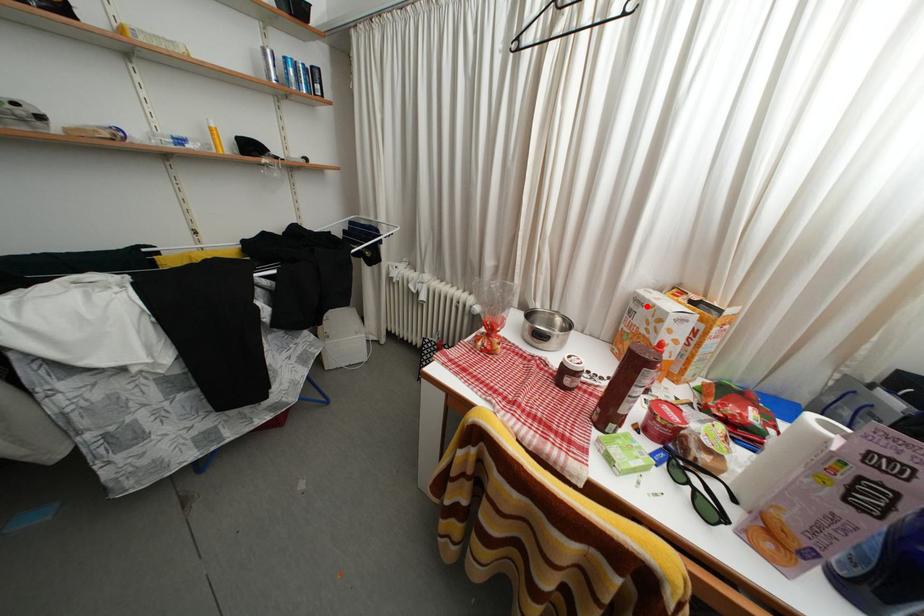
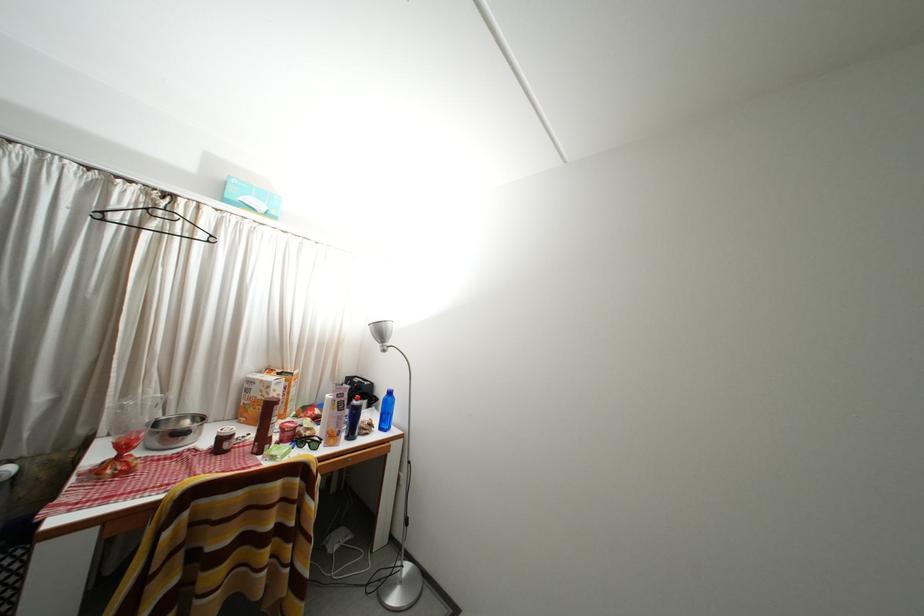
The point at the highlighted location is marked in the first image. Where is the corresponding point in the second image?

(259, 387)